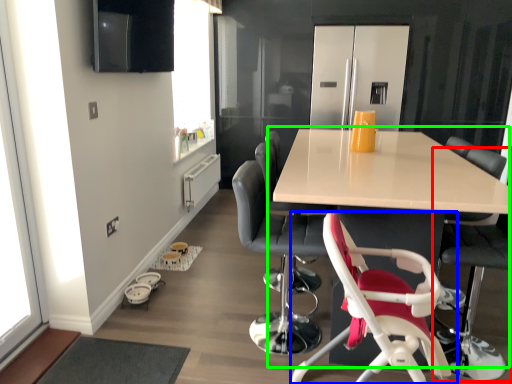
Question: Considering the real-world distances, which object is farthest from chair (highlighted by a red box)? chair (highlighted by a blue box) or table (highlighted by a green box)?

Choices:
 (A) chair
 (B) table

Answer: (B)